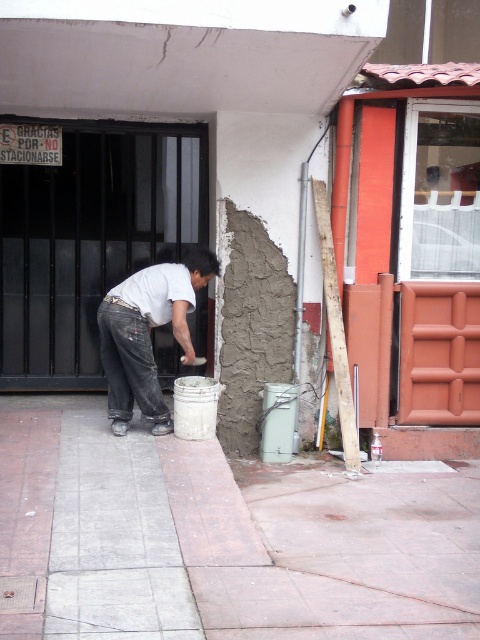
Does concrete at center have a smaller size compared to white matte shirt at center?

No, concrete at center is not smaller than white matte shirt at center.

Can you confirm if concrete at center is shorter than white matte shirt at center?

Yes.

The image size is (480, 640). What do you see at coordinates (220, 538) in the screenshot? I see `concrete at center` at bounding box center [220, 538].

Image resolution: width=480 pixels, height=640 pixels. I want to click on concrete at center, so click(220, 538).